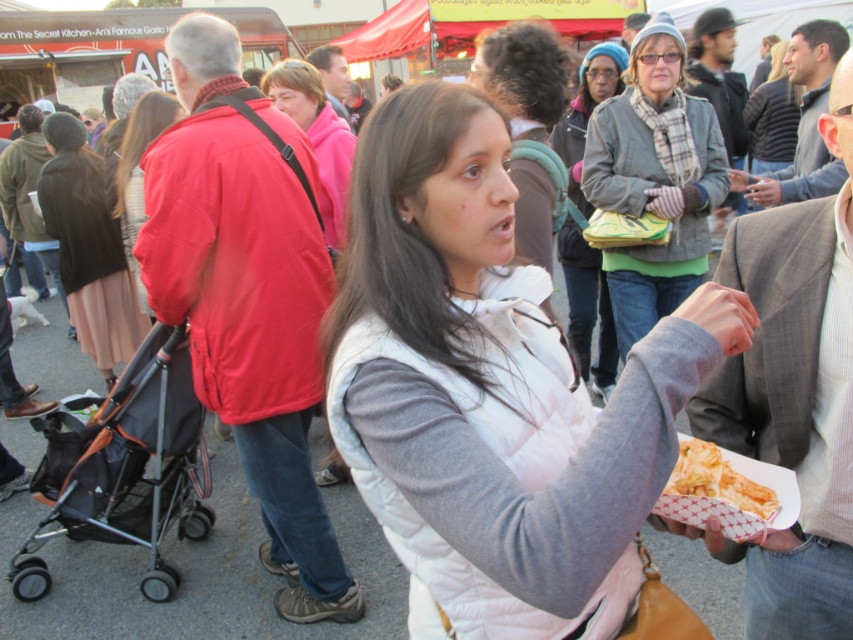
Is the position of white quilted vest at center less distant than that of gray wool scarf at upper center?

That is True.

Looking at this image, does white quilted vest at center appear over gray wool scarf at upper center?

Result: Incorrect, white quilted vest at center is not positioned above gray wool scarf at upper center.

Is point (479, 346) in front of point (645, 86)?

Yes, point (479, 346) is in front of point (645, 86).

This screenshot has width=853, height=640. I want to click on white quilted vest at center, so click(x=492, y=387).

Does gray striped shirt at center have a greater height compared to shiny paper food at center?

Yes.

Where is `gray striped shirt at center`? gray striped shirt at center is located at coordinates (793, 396).

Is gray wool scarf at upper center thinner than smooth red jacket at upper center?

No, gray wool scarf at upper center is not thinner than smooth red jacket at upper center.

Which of these two, gray wool scarf at upper center or smooth red jacket at upper center, stands shorter?

With less height is smooth red jacket at upper center.

Who is more distant from viewer, (648,328) or (334,72)?

The point (334,72) is more distant.

Locate an element on the screen. The width and height of the screenshot is (853, 640). gray wool scarf at upper center is located at coordinates (654, 180).